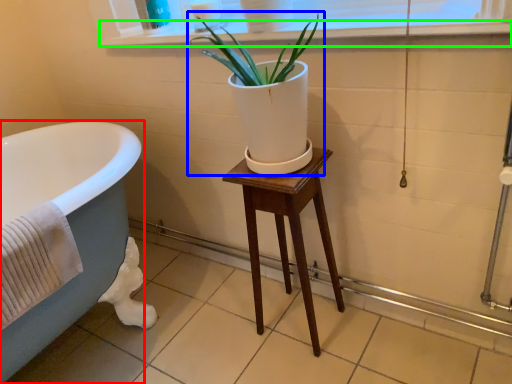
Question: Estimate the real-world distances between objects in this image. Which object is farther from bathtub (highlighted by a red box), houseplant (highlighted by a blue box) or window sill (highlighted by a green box)?

Choices:
 (A) houseplant
 (B) window sill

Answer: (B)